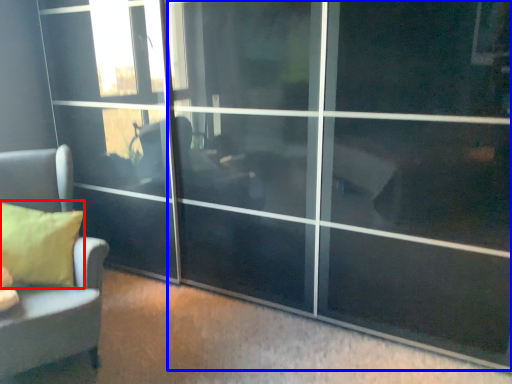
Question: Among these objects, which one is farthest to the camera, pillow (highlighted by a red box) or screen door (highlighted by a blue box)?

Choices:
 (A) pillow
 (B) screen door

Answer: (A)